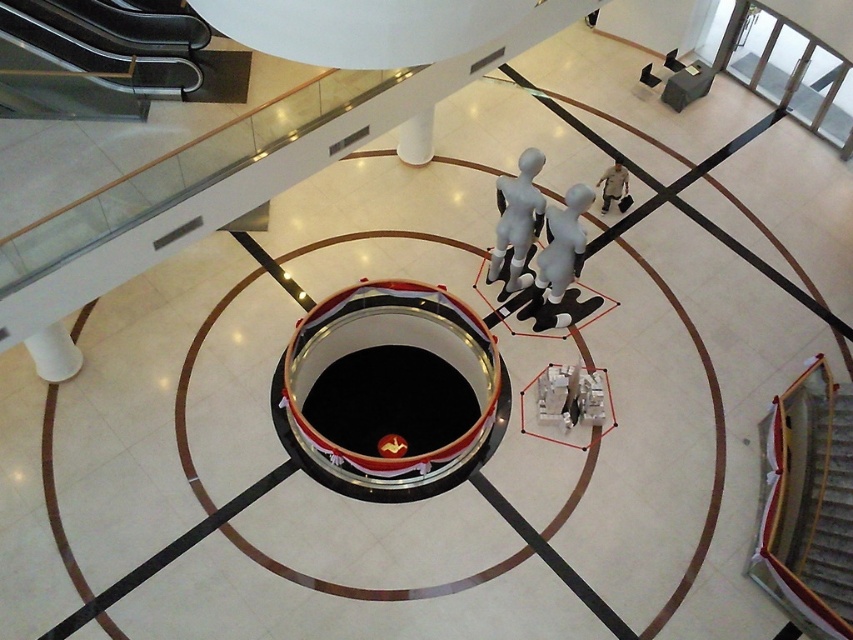
Does smooth matte mannequin at center appear on the right side of white matte mannequin at center?

Yes, smooth matte mannequin at center is to the right of white matte mannequin at center.

Between smooth matte mannequin at center and white matte mannequin at center, which one appears on the left side from the viewer's perspective?

From the viewer's perspective, white matte mannequin at center appears more on the left side.

Does point (563, 232) come farther from viewer compared to point (527, 227)?

No, (563, 232) is in front of (527, 227).

You are a GUI agent. You are given a task and a screenshot of the screen. Output one action in this format:
    pyautogui.click(x=<x>, y=<y>)
    Task: Click on the smooth matte mannequin at center
    
    Given the screenshot: What is the action you would take?
    pyautogui.click(x=558, y=259)

Image resolution: width=853 pixels, height=640 pixels. What do you see at coordinates (827, 504) in the screenshot? I see `wooden staircase at lower right` at bounding box center [827, 504].

Who is positioned more to the right, wooden staircase at lower right or white matte mannequin at center?

wooden staircase at lower right

Is point (831, 563) positioned before point (509, 244)?

That is True.

Where is `wooden staircase at lower right`? The image size is (853, 640). wooden staircase at lower right is located at coordinates (827, 504).

Can you confirm if wooden staircase at lower right is taller than brown fabric shirt at upper right?

Yes, wooden staircase at lower right is taller than brown fabric shirt at upper right.

Between point (834, 580) and point (606, 209), which one is positioned in front?

Point (834, 580) is in front.

This screenshot has width=853, height=640. I want to click on wooden staircase at lower right, so click(x=827, y=504).